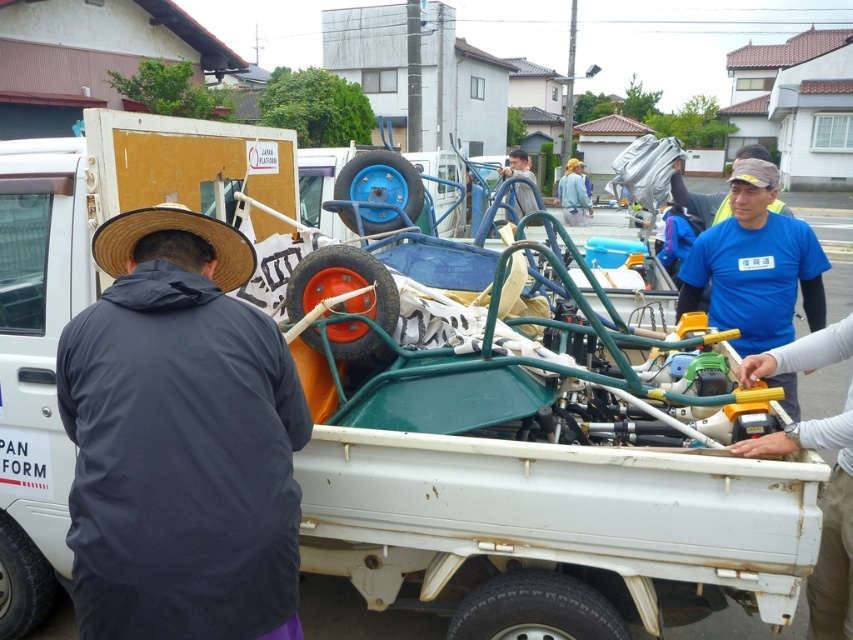
Based on the photo, you are a delivery person trying to navigate through the scene. You need to pass between the green metallic cart at center and the light gray fabric shirt at center. Which side of the cart should you go around to avoid the person?

Since the green metallic cart at center is on the left side of the light gray fabric shirt at center, you should go around the right side of the green metallic cart at center to avoid the person.

You are standing at the edge of the scene and want to hand a tool to both the dark gray fabric hat at left and the blue fabric shirt at center. Which person should you approach first to ensure you can reach them without moving past the other?

You should approach the dark gray fabric hat at left first because it is in front of the blue fabric shirt at center, so you can reach them without needing to move past the other person.

You are a delivery person trying to navigate through the scene. You need to place a large package on the green metallic cart at center. Considering the height of the cart and the light gray fabric shirt at center, will the package be visible from above once placed?

The green metallic cart at center has a lesser height compared to light gray fabric shirt at center. Since the cart is shorter, the package placed on it would be lower, making it visible from above unless the shirt wearer is blocking the view.